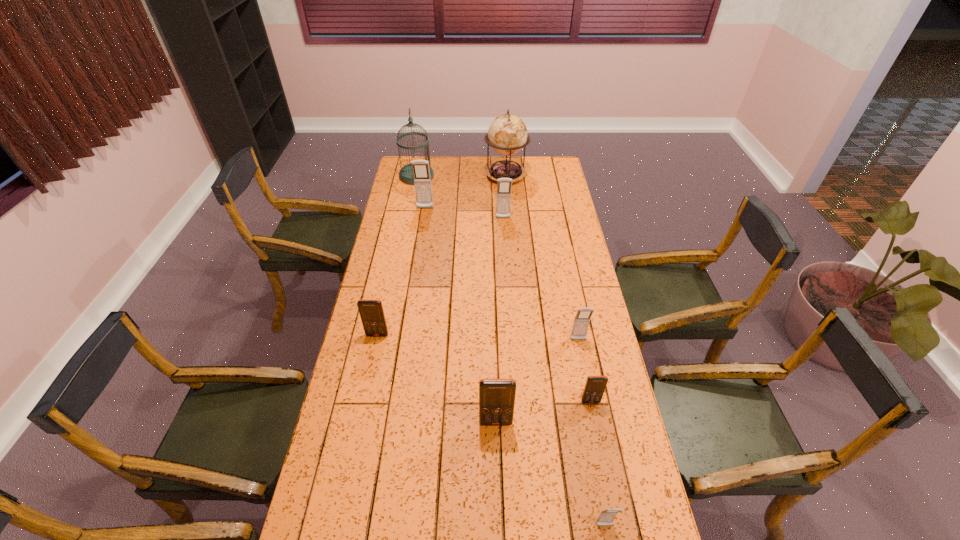
In order to click on the sixth closest object relative to the second biggest orange cellular telephone in this screenshot , I will do `click(606, 517)`.

Find the location of a particular element. This screenshot has height=540, width=960. cellular telephone that can be found as the third closest to the tallest cellular telephone is located at coordinates (581, 322).

Locate an element on the screen. the third closest cellular telephone relative to the nearest object is located at coordinates (581, 322).

Identify which gray cellular telephone is the nearest to the leftmost cellular telephone. Please provide its 2D coordinates. Your answer should be formatted as a tuple, i.e. [(x, y)], where the tuple contains the x and y coordinates of a point satisfying the conditions above.

[(581, 322)]

You are a GUI agent. You are given a task and a screenshot of the screen. Output one action in this format:
    pyautogui.click(x=<x>, y=<y>)
    Task: Click on the third closest gray cellular telephone to the globe
    
    Given the screenshot: What is the action you would take?
    pyautogui.click(x=581, y=322)

Where is `orange cellular telephone that is the second closest one to the eighth farthest object`? This screenshot has width=960, height=540. orange cellular telephone that is the second closest one to the eighth farthest object is located at coordinates (371, 312).

Where is `orange cellular telephone that is the closest to the rightmost orange cellular telephone`? The image size is (960, 540). orange cellular telephone that is the closest to the rightmost orange cellular telephone is located at coordinates (496, 396).

What are the coordinates of `free space in the image that satisfies the following two spatial constraints: 1. on the front-facing side of the birdcage; 2. on the screen of the leftmost orange cellular telephone` in the screenshot? It's located at (386, 335).